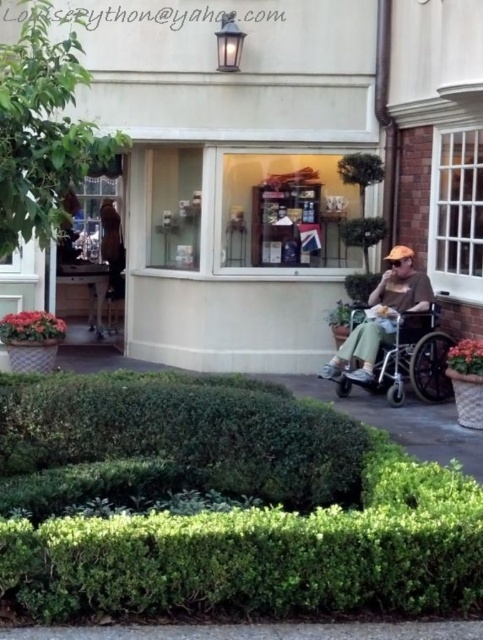
You are a visitor approaching the building and notice the silver metallic wheelchair at right and the matte brown shirt at right. Which object is closer to the ground?

The silver metallic wheelchair at right is shorter than the matte brown shirt at right, so it is closer to the ground.

You are a visitor approaching the building and want to take a photo of the silver metallic wheelchair at right and the matte brown shirt at right. Which object should you focus on first to ensure both are in the frame?

You should focus on the silver metallic wheelchair at right first since it is closer to you than the matte brown shirt at right, ensuring both are in the frame.